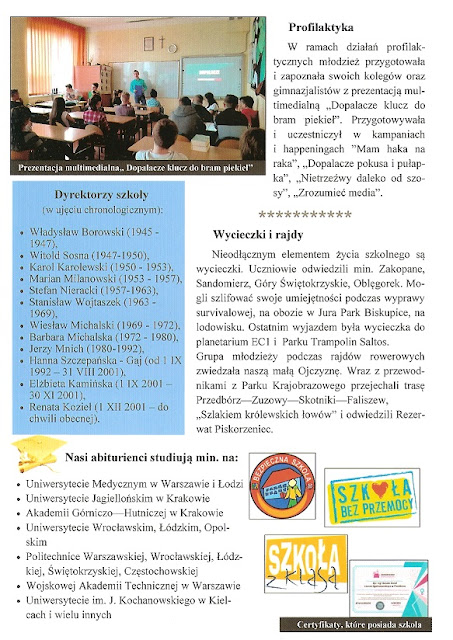
This screenshot has width=453, height=640. I want to click on classroom, so click(141, 84).